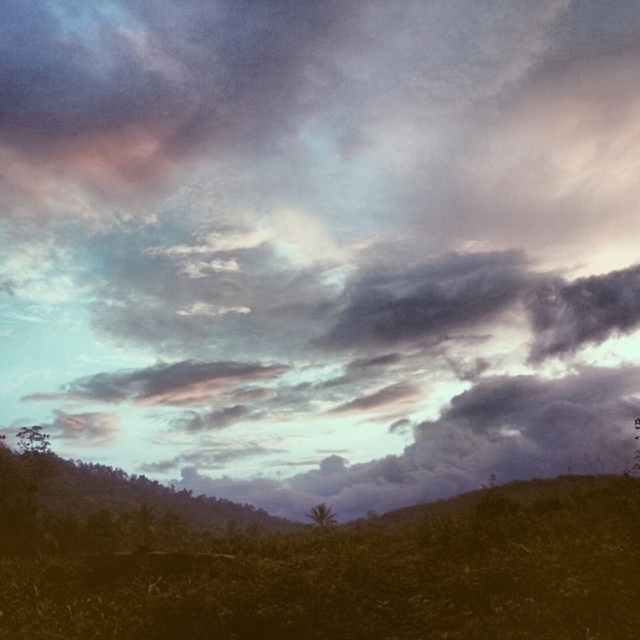
You are standing in the green grassy field at lower center and want to walk towards the green leafy tree at center. Which direction should you move to get closer to the tree?

Since the green grassy field at lower center is in front of the green leafy tree at center, you should move forward to get closer to the tree.

You are standing at the point labeled as point (364, 577) and want to walk towards the green grassy field at lower center. Is your current position already at the green grassy field at lower center?

Yes, the point (364, 577) corresponds to the green grassy field at lower center, so you are already at the green grassy field at lower center.